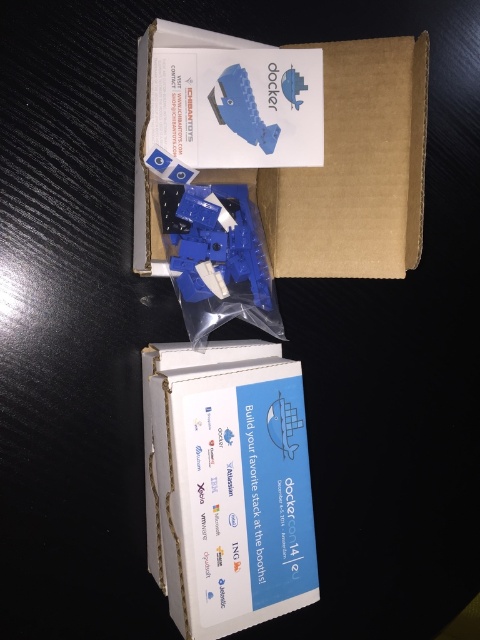
You are standing in front of two cardboard boxes on a table. You see a point marked at coordinates [228,484]. Which object does this point correspond to?

The point at coordinates [228,484] corresponds to the white cardboard box at center.

Looking at this image, you are standing 30 inches away from a table with a white cardboard box at center. Can you safely reach the box without moving your feet?

The white cardboard box at center is 33.04 inches away from the viewer. Since you are standing 30 inches away from the table, the box is 3.04 inches beyond your current reach. You may need to take a small step forward to safely reach it.